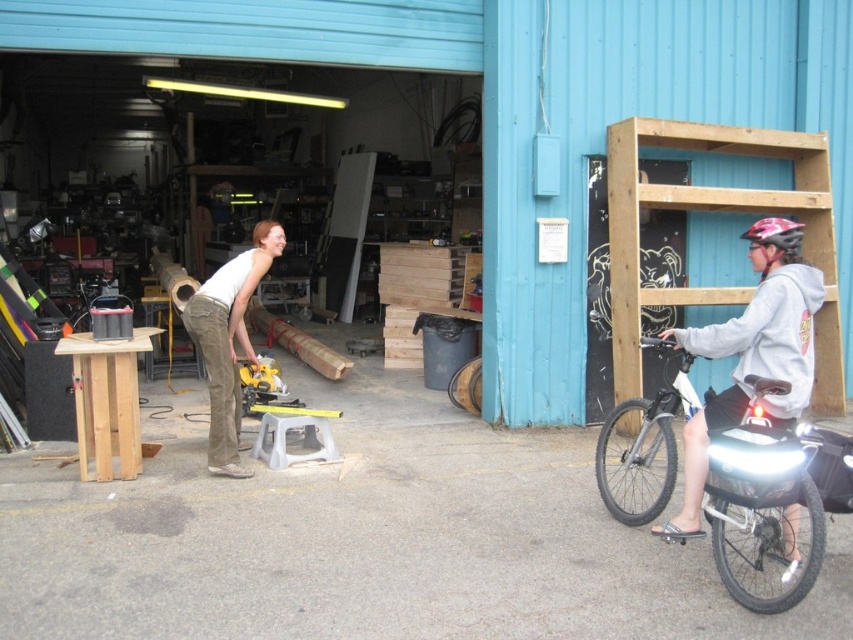
You are a delivery person who needs to load a shiny metallic bicycle at right and a white matte shirt at center into a truck. The truck has a height limit of 1.5 meters. Can both items fit vertically without bending or damaging them?

The shiny metallic bicycle at right is shorter than the white matte shirt at center. However, since the white matte shirt at center is likely a clothing item and not a rigid structure, its height isn

You are standing at the entrance of the blue corrugated metal building and want to hand a tool to the person wearing the white matte shirt at center. Based on their position at point 0.533, 0.268, can you determine if they are positioned to your left or right side?

The white matte shirt at center is located at point (228, 340), which means the person is positioned to your right side.